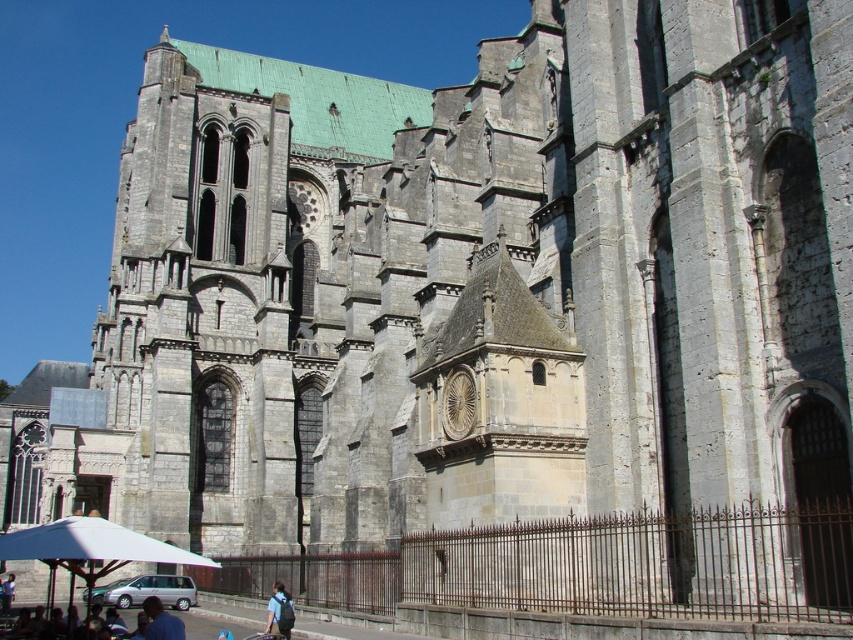
You are a tourist standing in front of the cathedral. You notice a dark blue shirt at lower center and a blue fabric backpack at lower center. Which object is closer to you?

The dark blue shirt at lower center is closer to you as it is in front of the blue fabric backpack at lower center.

You are standing in front of the cathedral and notice two points marked on the facade. The first point is at coordinates point (158, 627) and the second is at point (270, 618). Which point is closer to you?

Point (158, 627) is in front of point (270, 618), so it is closer to you.